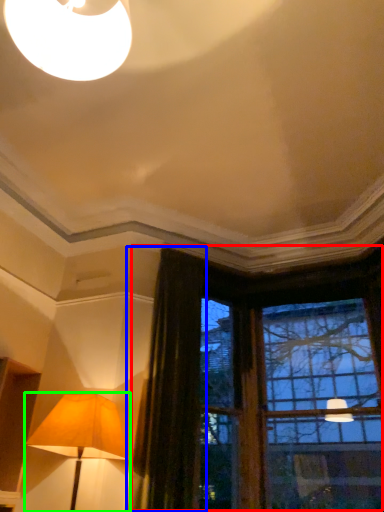
Question: Which object is positioned farthest from window (highlighted by a red box)? Select from curtain (highlighted by a blue box) and lamp (highlighted by a green box).

Choices:
 (A) curtain
 (B) lamp

Answer: (B)